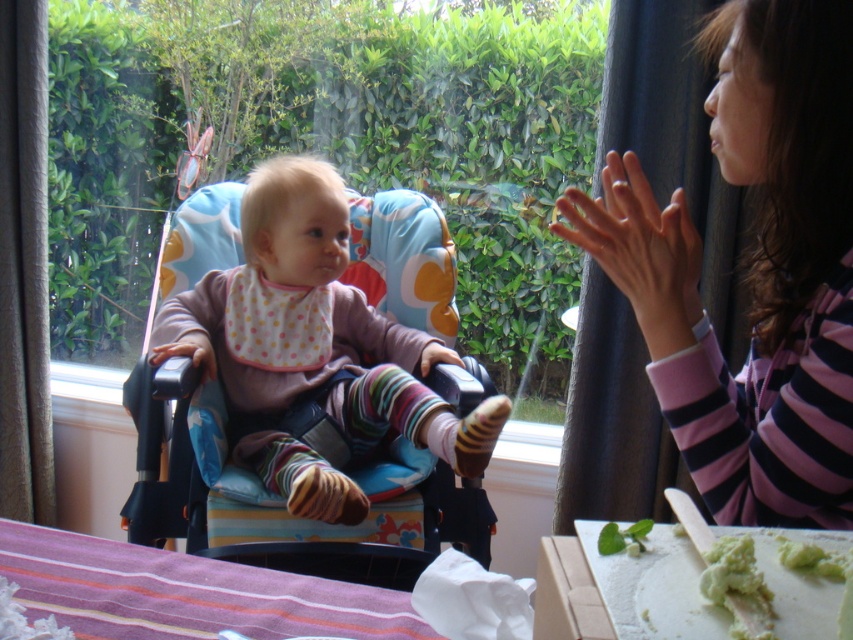
You are a parent observing your baby in the high chair. You notice the smooth skin hands at upper right and the green leafy vegetable at lower center. Which object is located above the other?

The smooth skin hands at upper right is positioned over the green leafy vegetable at lower center, so the smooth skin hands at upper right is above the green leafy vegetable at lower center.

You are a caregiver looking at the baby in the high chair. You notice the smooth skin hands at upper right. Where exactly are the smooth skin hands located relative to the baby?

The smooth skin hands at upper right are located at point (639, 250) relative to the baby.

You are a caregiver holding a spoon with the smooth skin hands at upper right. The green creamy food at lower right is on the baby tray. Can you reach the food with your hand without moving your body?

The distance between the smooth skin hands at upper right and the green creamy food at lower right is 15.23 inches. Since the average human arm span allows reaching about 18 inches, you can comfortably reach the green creamy food at lower right with your hand without moving your body.